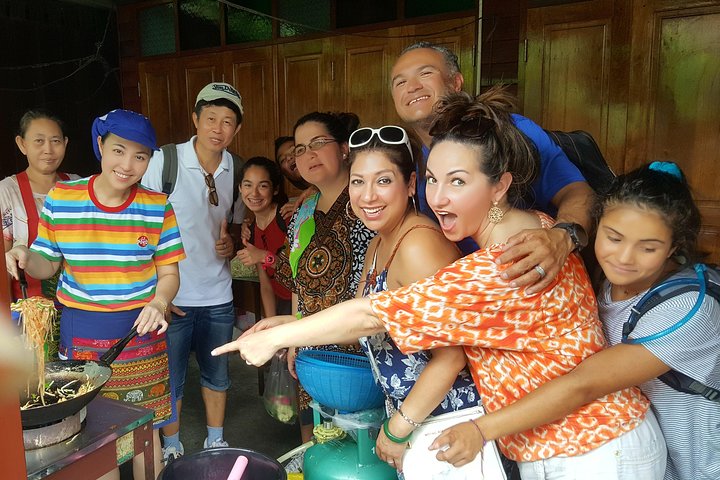
This screenshot has width=720, height=480. Identify the location of red apron. (29, 206).